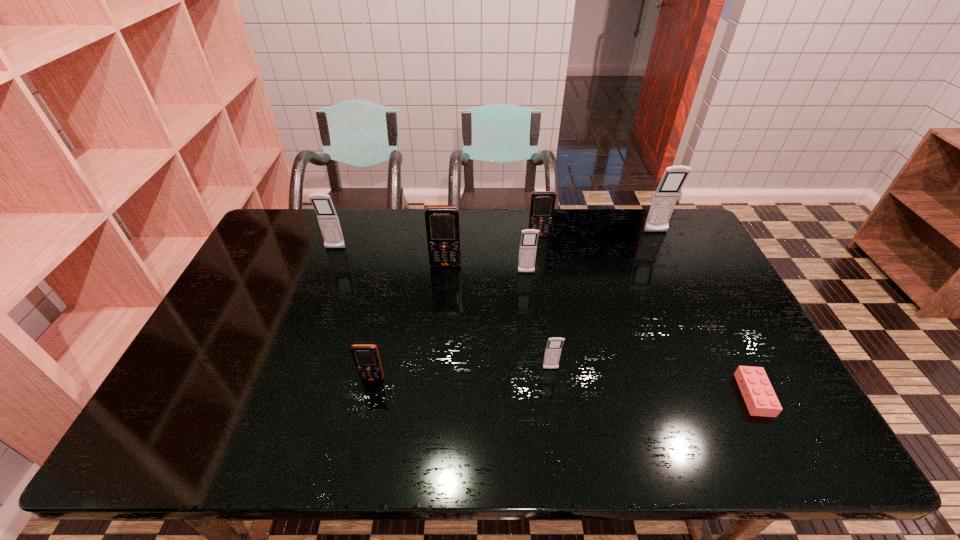
The height and width of the screenshot is (540, 960). Identify the location of vacant space that satisfies the following two spatial constraints: 1. on the front-facing side of the pink Lego; 2. on the right side of the sixth farthest object. (554, 395).

At what (x,y) coordinates should I click in order to perform the action: click on blank area in the image that satisfies the following two spatial constraints: 1. on the front-facing side of the Lego; 2. on the right side of the farthest gray cellular telephone. Please return your answer as a coordinate pair (x, y). The height and width of the screenshot is (540, 960). Looking at the image, I should click on (733, 395).

Image resolution: width=960 pixels, height=540 pixels. I want to click on free location that satisfies the following two spatial constraints: 1. on the front-facing side of the pink Lego; 2. on the left side of the second biggest gray cellular telephone, so click(280, 395).

Where is `vacant region that satisfies the following two spatial constraints: 1. on the screen of the second nearest orange cellular telephone; 2. on the right side of the Lego`? This screenshot has height=540, width=960. vacant region that satisfies the following two spatial constraints: 1. on the screen of the second nearest orange cellular telephone; 2. on the right side of the Lego is located at coordinates (435, 395).